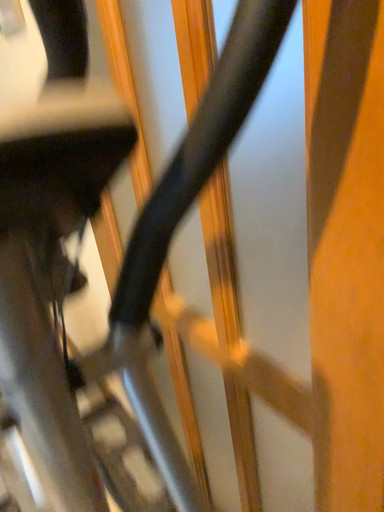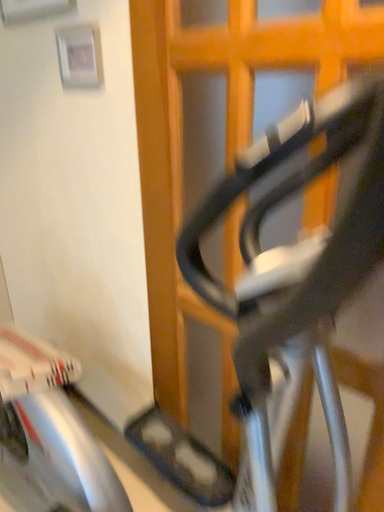
Question: Which way did the camera rotate in the video?

Choices:
 (A) rotated left
 (B) rotated right

Answer: (B)